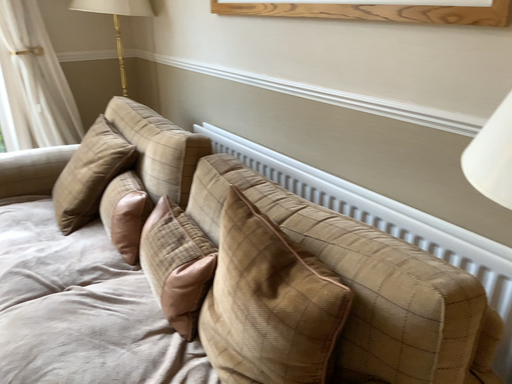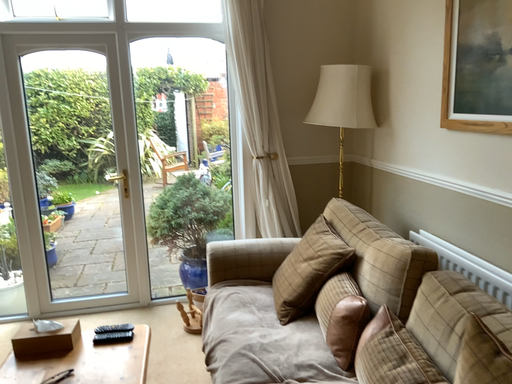
Question: Which way did the camera rotate in the video?

Choices:
 (A) rotated upward
 (B) rotated downward

Answer: (A)